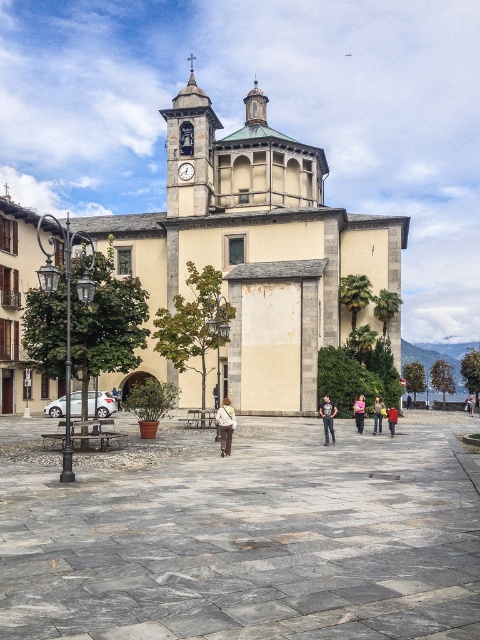
You are standing at the entrance of the European church and want to find the light brown leather jacket at center. According to the coordinates provided, in which direction should you look to locate it?

The light brown leather jacket at center is located at point coordinates, so you should look towards the center of the square to find it.